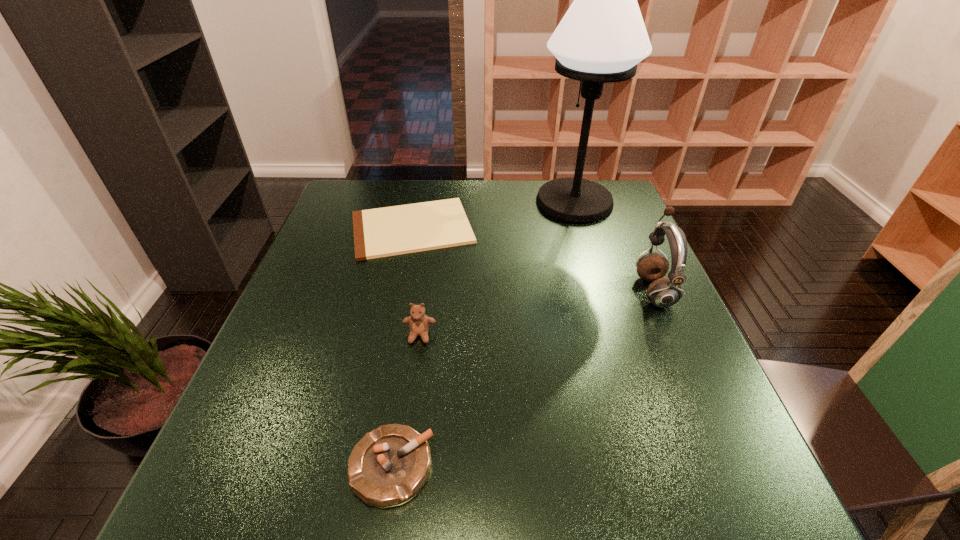
Find the location of a particular element. The height and width of the screenshot is (540, 960). table lamp is located at coordinates (602, 37).

The height and width of the screenshot is (540, 960). I want to click on earphone, so click(x=664, y=292).

Image resolution: width=960 pixels, height=540 pixels. What are the coordinates of `the fourth shortest object` in the screenshot? It's located at (664, 292).

At what (x,y) coordinates should I click in order to perform the action: click on teddy bear. Please return your answer as a coordinate pair (x, y). This screenshot has width=960, height=540. Looking at the image, I should click on (419, 323).

At what (x,y) coordinates should I click in order to perform the action: click on the third tallest object. Please return your answer as a coordinate pair (x, y). This screenshot has height=540, width=960. Looking at the image, I should click on (419, 323).

Identify the location of the nearest object. (390, 464).

Locate an element on the screen. The width and height of the screenshot is (960, 540). ashtray is located at coordinates click(x=390, y=464).

Where is `the shortest object`? This screenshot has width=960, height=540. the shortest object is located at coordinates (389, 231).

Find the location of a particular element. This screenshot has width=960, height=540. vacant area situated 0.210m on the front of the tallest object is located at coordinates (595, 272).

Where is `vacant space located 0.310m on the ear pads of the third nearest object`? vacant space located 0.310m on the ear pads of the third nearest object is located at coordinates (511, 290).